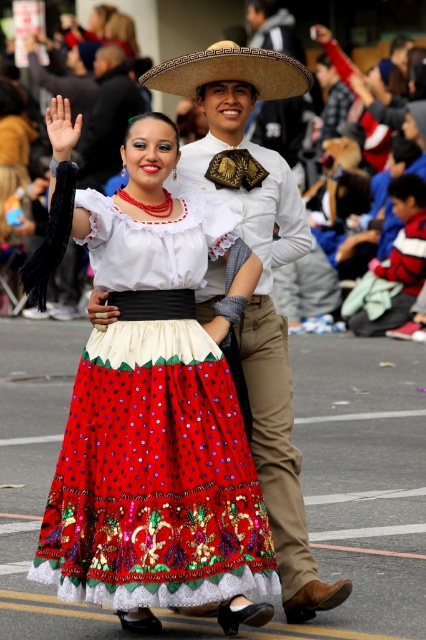
Which is above, brown woven straw hat at upper center or matte straw hat at center?

matte straw hat at center

Which is behind, point (233, 44) or point (267, 28)?

Positioned behind is point (267, 28).

You are a GUI agent. You are given a task and a screenshot of the screen. Output one action in this format:
    pyautogui.click(x=<x>, y=<y>)
    Task: Click on the brown woven straw hat at upper center
    Image resolution: width=426 pixels, height=640 pixels.
    Given the screenshot: What is the action you would take?
    pyautogui.click(x=230, y=72)

Who is shorter, embroidered cotton skirt at center or brown woven straw hat at upper center?

With less height is brown woven straw hat at upper center.

Locate an element on the screen. embroidered cotton skirt at center is located at coordinates (155, 433).

Consider the image. Which is below, embroidered cotton skirt at center or matte straw hat at center?

embroidered cotton skirt at center is below.

Is embroidered cotton skirt at center thinner than matte straw hat at center?

No, embroidered cotton skirt at center is not thinner than matte straw hat at center.

Where is `embroidered cotton skirt at center`? This screenshot has height=640, width=426. embroidered cotton skirt at center is located at coordinates (155, 433).

Locate an element on the screen. This screenshot has width=426, height=640. embroidered cotton skirt at center is located at coordinates (155, 433).